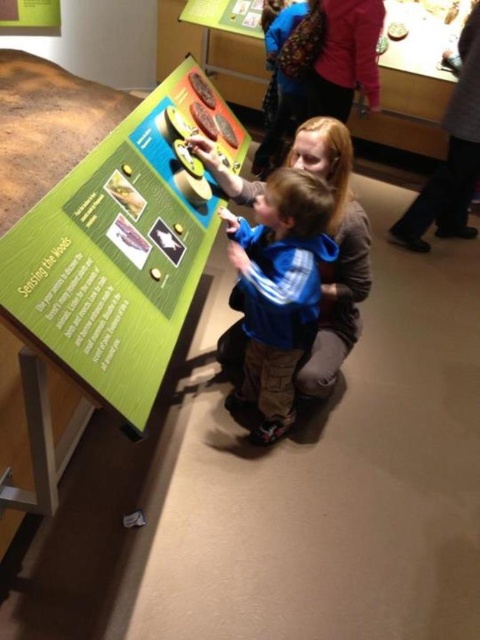
You are standing at the entrance of the museum and want to locate the green matte board at center. What are the coordinates where you should look?

The green matte board at center is located at coordinates point (120, 248).